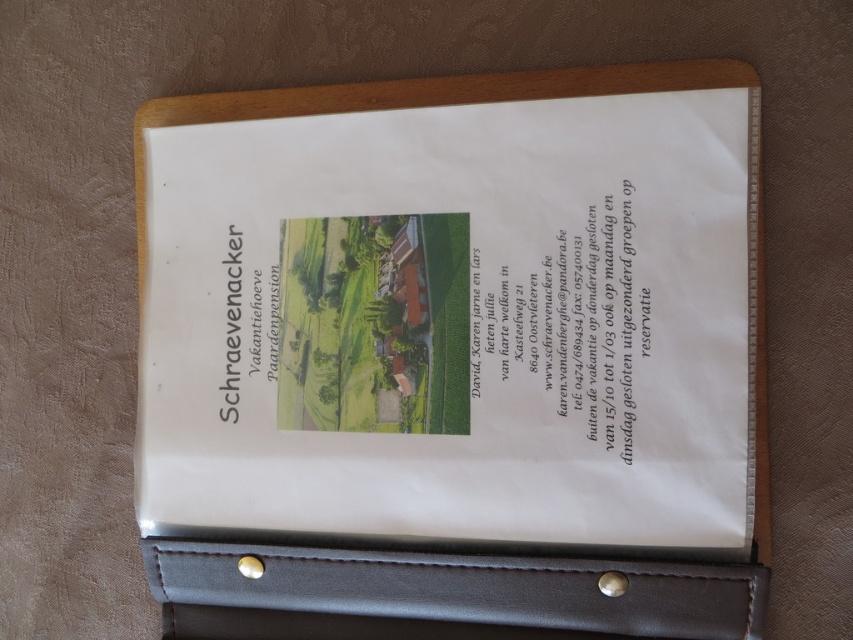
Question: Does white paper at center have a smaller size compared to black leather pocket at bottom?

Choices:
 (A) no
 (B) yes

Answer: (A)

Question: Does white paper at center appear under black leather pocket at bottom?

Choices:
 (A) no
 (B) yes

Answer: (A)

Question: Among these points, which one is nearest to the camera?

Choices:
 (A) (663, 292)
 (B) (219, 577)

Answer: (A)

Question: Can you confirm if white paper at center is positioned below black leather pocket at bottom?

Choices:
 (A) no
 (B) yes

Answer: (A)